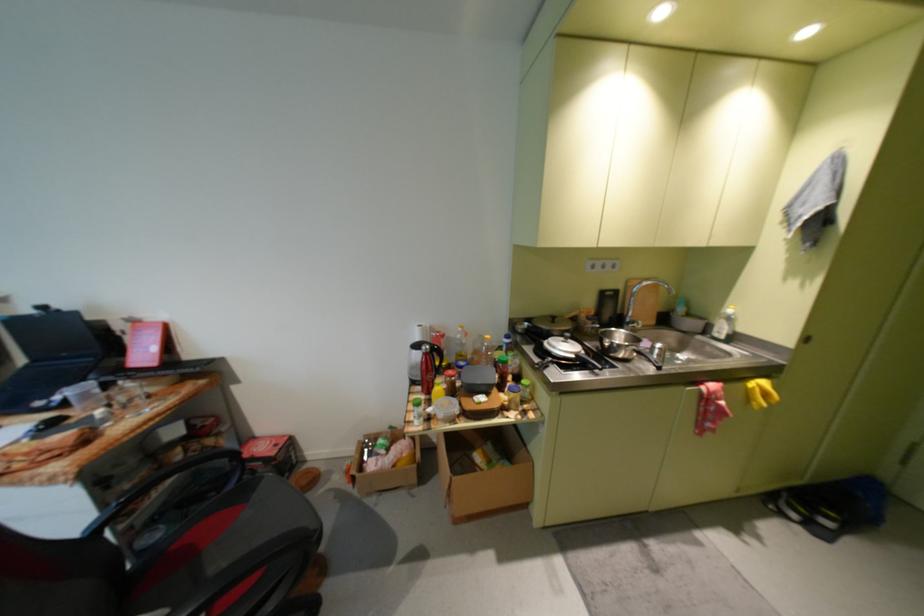
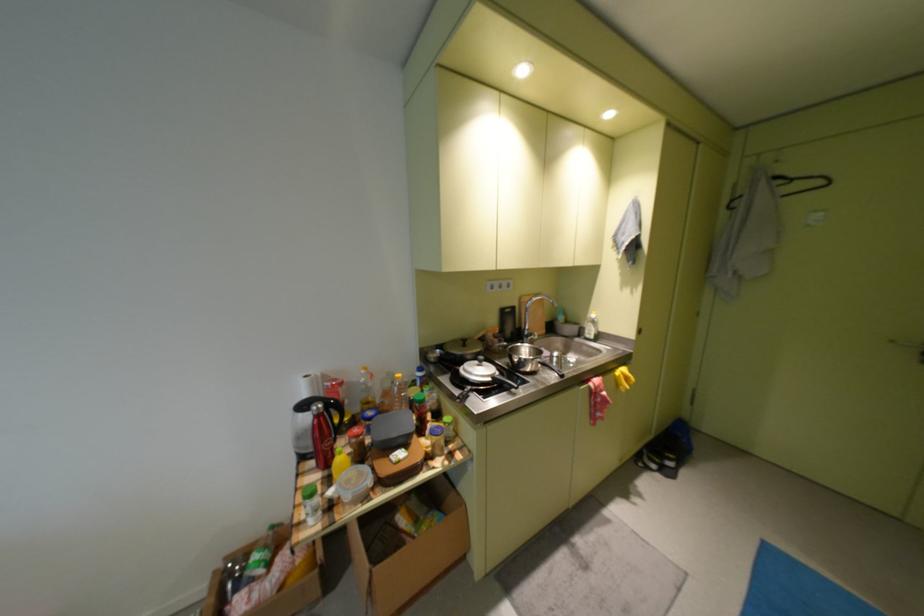
Question: The images are taken continuously from a first-person perspective. In which direction are you moving?

Choices:
 (A) Left
 (B) Right
 (C) Forward
 (D) Backward

Answer: (C)